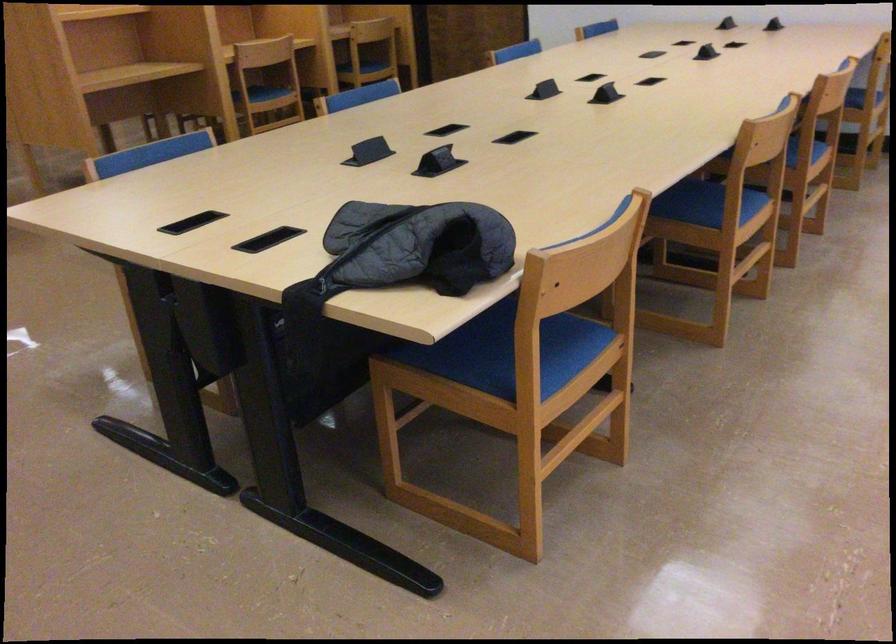
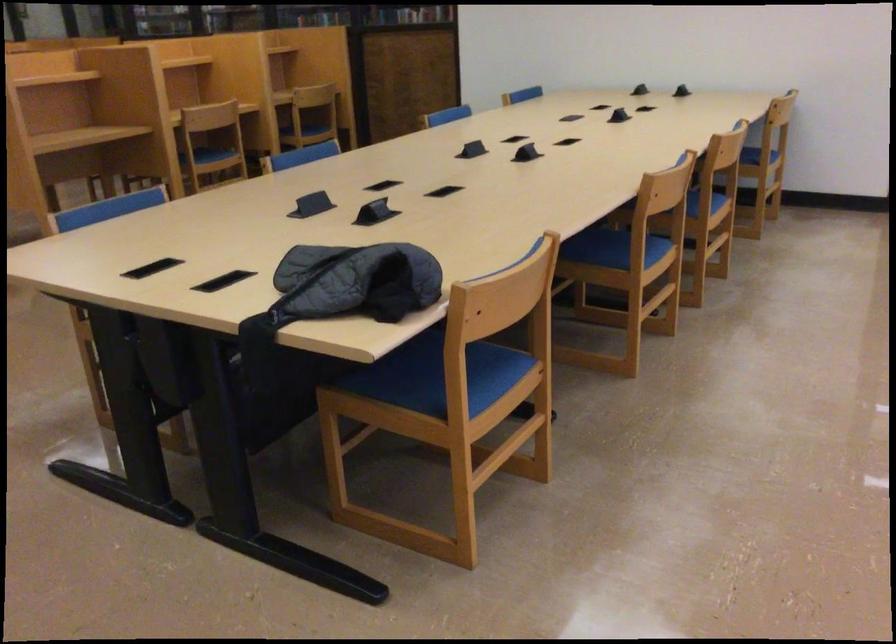
Where in the second image is the point corresponding to point (521, 361) from the first image?

(451, 381)